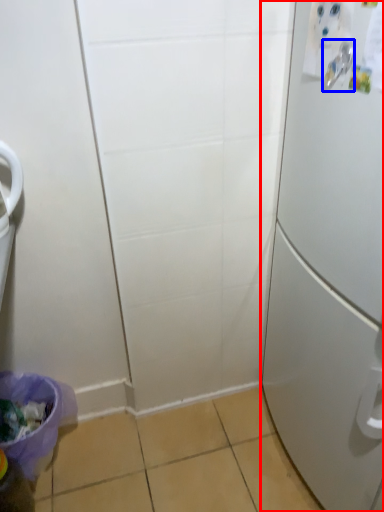
Question: Which object appears farthest to the camera in this image, refrigerator (highlighted by a red box) or door handle (highlighted by a blue box)?

Choices:
 (A) refrigerator
 (B) door handle

Answer: (B)